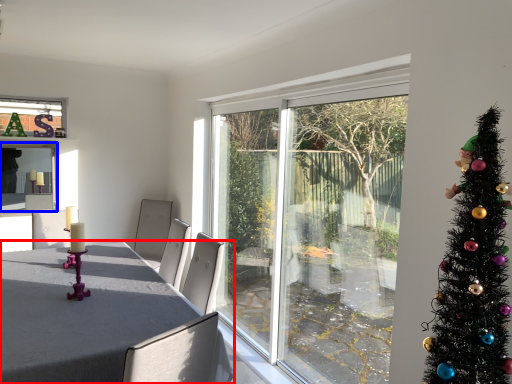
Question: Which point is closer to the camera, table (highlighted by a red box) or window screen (highlighted by a blue box)?

Choices:
 (A) table
 (B) window screen

Answer: (A)